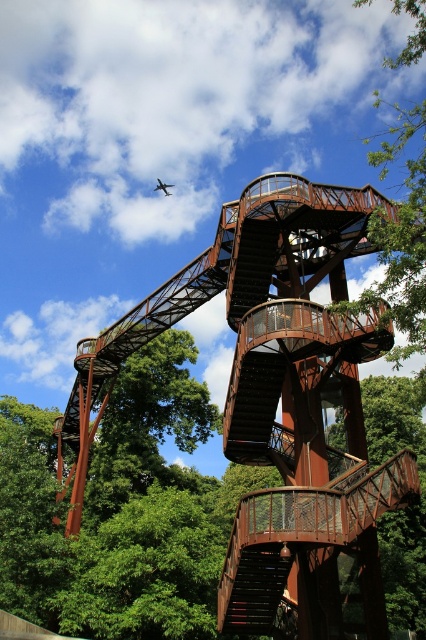
Question: Which point appears farthest from the camera in this image?

Choices:
 (A) (249, 216)
 (B) (253, 573)

Answer: (A)

Question: Can you confirm if green leafy tree at upper right is positioned below rusty metal staircase at center?

Choices:
 (A) no
 (B) yes

Answer: (A)

Question: Which object is farther from the camera taking this photo?

Choices:
 (A) metallic silver airplane at upper center
 (B) green leafy tree at upper right
 (C) rusty metal stairs at center
 (D) rusty metal staircase at center

Answer: (A)

Question: Estimate the real-world distances between objects in this image. Which object is closer to the rusty metal staircase at center?

Choices:
 (A) rusty metal stairs at center
 (B) green leafy tree at upper right
 (C) metallic silver airplane at upper center

Answer: (A)

Question: Is rusty metal staircase at center below metallic silver airplane at upper center?

Choices:
 (A) yes
 (B) no

Answer: (A)

Question: Does rusty metal stairs at center appear under metallic silver airplane at upper center?

Choices:
 (A) no
 (B) yes

Answer: (B)